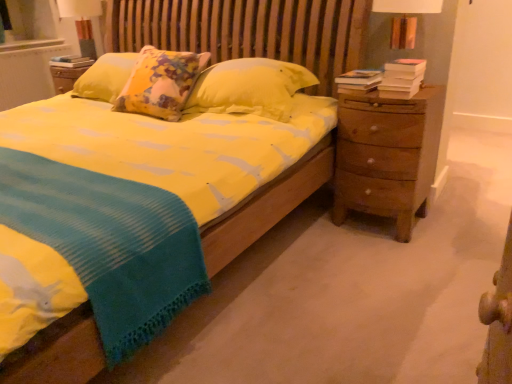
Question: From a real-world perspective, does matte white lampshade at upper left stand above hardcover books at right, acting as the second book starting from the left?

Choices:
 (A) yes
 (B) no

Answer: (A)

Question: From a real-world perspective, is matte white lampshade at upper left located beneath hardcover books at right, the 2th book ordered from the bottom?

Choices:
 (A) yes
 (B) no

Answer: (B)

Question: Does matte white lampshade at upper left have a smaller size compared to hardcover books at right, the 2th book from the back?

Choices:
 (A) yes
 (B) no

Answer: (B)

Question: Is matte white lampshade at upper left shorter than hardcover books at right, the 2th book from the back?

Choices:
 (A) no
 (B) yes

Answer: (A)

Question: From the image's perspective, is matte white lampshade at upper left over hardcover books at right, the second book when ordered from right to left?

Choices:
 (A) yes
 (B) no

Answer: (A)

Question: In terms of width, does brown wooden nightstand at right look wider or thinner when compared to yellow cotton bed at center?

Choices:
 (A) thin
 (B) wide

Answer: (A)

Question: In the image, is brown wooden nightstand at right positioned in front of or behind yellow cotton bed at center?

Choices:
 (A) front
 (B) behind

Answer: (B)

Question: In terms of size, does brown wooden nightstand at right appear bigger or smaller than yellow cotton bed at center?

Choices:
 (A) small
 (B) big

Answer: (A)

Question: Is brown wooden nightstand at right inside or outside of yellow cotton bed at center?

Choices:
 (A) outside
 (B) inside

Answer: (A)

Question: From a real-world perspective, is hardcover book at right, marked as the third book in a left-to-right arrangement, above or below hardcover book at upper left, positioned as the third book in bottom-to-top order?

Choices:
 (A) below
 (B) above

Answer: (B)

Question: From the image's perspective, relative to hardcover book at upper left, which appears as the first book when viewed from the left, is hardcover book at right, positioned as the first book in front-to-back order, above or below?

Choices:
 (A) below
 (B) above

Answer: (A)

Question: Based on their sizes in the image, would you say hardcover book at right, acting as the 3th book starting from the back, is bigger or smaller than hardcover book at upper left, arranged as the first book when viewed from the back?

Choices:
 (A) big
 (B) small

Answer: (A)

Question: Is hardcover book at right, which is the third book from top to bottom, in front of or behind hardcover book at upper left, the first book viewed from the top, in the image?

Choices:
 (A) front
 (B) behind

Answer: (A)

Question: In the image, is hardcover book at upper left, acting as the third book starting from the front, positioned in front of or behind white textured radiator at upper left?

Choices:
 (A) behind
 (B) front

Answer: (B)

Question: Visually, is hardcover book at upper left, arranged as the first book when viewed from the back, positioned to the left or to the right of white textured radiator at upper left?

Choices:
 (A) right
 (B) left

Answer: (A)